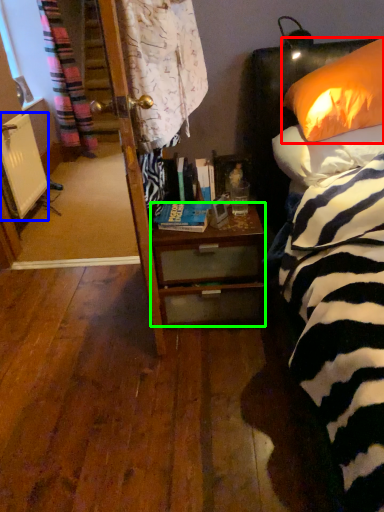
Question: Which is nearer to the pillow (highlighted by a red box)? radiator (highlighted by a blue box) or desk (highlighted by a green box).

Choices:
 (A) radiator
 (B) desk

Answer: (B)